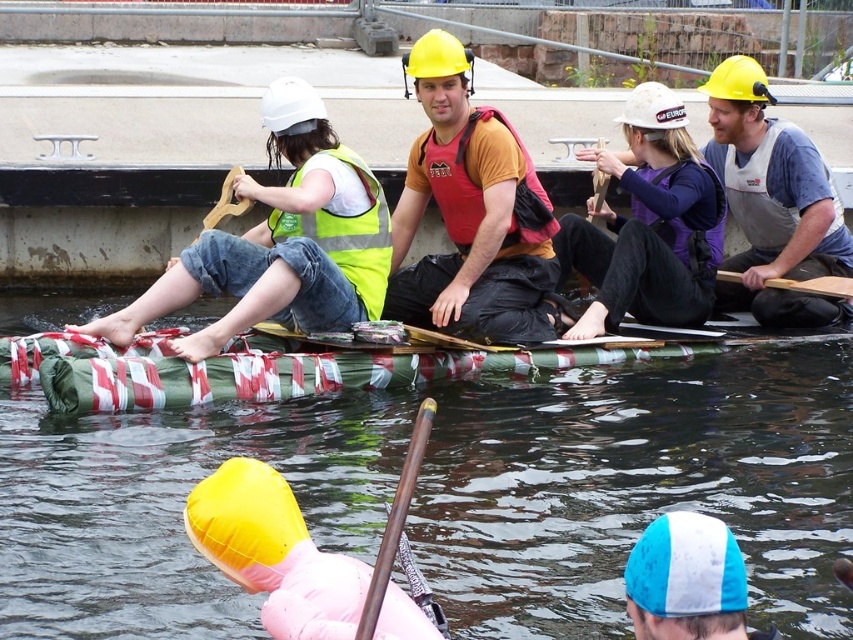
Who is more forward, (x=381, y=561) or (x=737, y=273)?

Point (x=381, y=561) is more forward.

Is point (376, 586) positioned after point (843, 284)?

No, it is not.

This screenshot has width=853, height=640. What are the coordinates of `brown wood paddle at lower center` in the screenshot? It's located at (395, 520).

Is point (764, 176) closer to camera compared to point (314, 234)?

No, (764, 176) is further to viewer.

Can you confirm if matte gray vest at center is positioned below high visibility fabric safety vest at left?

Actually, matte gray vest at center is above high visibility fabric safety vest at left.

You are a GUI agent. You are given a task and a screenshot of the screen. Output one action in this format:
    pyautogui.click(x=<x>, y=<y>)
    Task: Click on the matte gray vest at center
    The image size is (853, 640).
    Given the screenshot: What is the action you would take?
    pyautogui.click(x=773, y=202)

What do you see at coordinates (648, 225) in the screenshot? The image size is (853, 640). I see `purple fleece jacket at upper center` at bounding box center [648, 225].

Which is above, purple fleece jacket at upper center or matte gray vest at center?

matte gray vest at center is above.

Which is behind, point (589, 148) or point (834, 236)?

The point (834, 236) is behind.

At what (x,y) coordinates should I click in order to perform the action: click on purple fleece jacket at upper center. Please return your answer as a coordinate pair (x, y). Looking at the image, I should click on (648, 225).